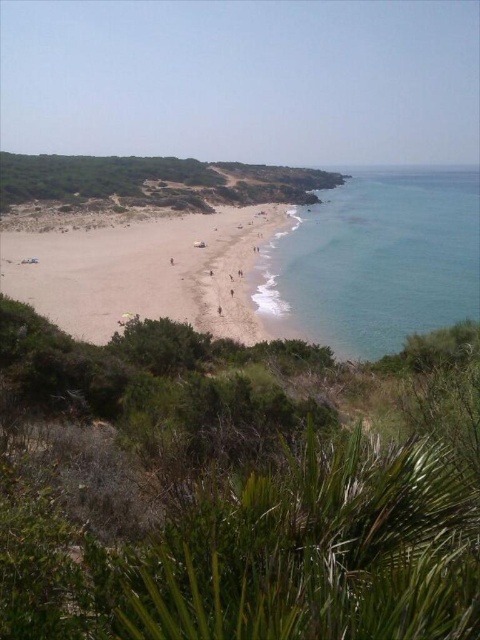
Does clear blue water at right have a greater height compared to light brown sand at lower left?

Yes.

Is clear blue water at right above light brown sand at lower left?

Yes, clear blue water at right is above light brown sand at lower left.

Is point (395, 278) in front of point (78, 321)?

No, (395, 278) is behind (78, 321).

Locate an element on the screen. The image size is (480, 640). clear blue water at right is located at coordinates (376, 260).